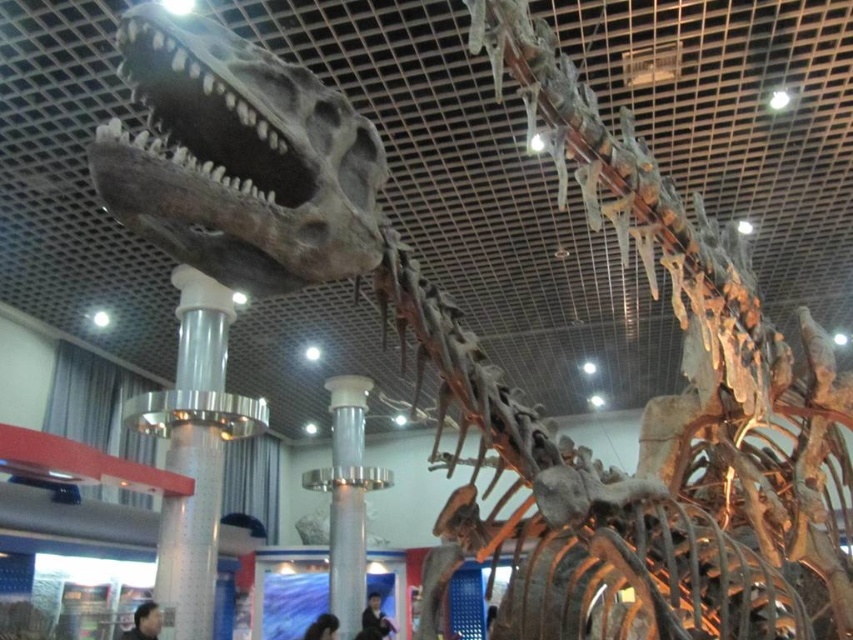
Consider the image. Between silver metallic column at center and silver metallic pillar at center, which one is positioned lower?

silver metallic pillar at center is below.

Does silver metallic column at center come behind silver metallic pillar at center?

No, it is in front of silver metallic pillar at center.

The width and height of the screenshot is (853, 640). I want to click on silver metallic column at center, so click(190, 529).